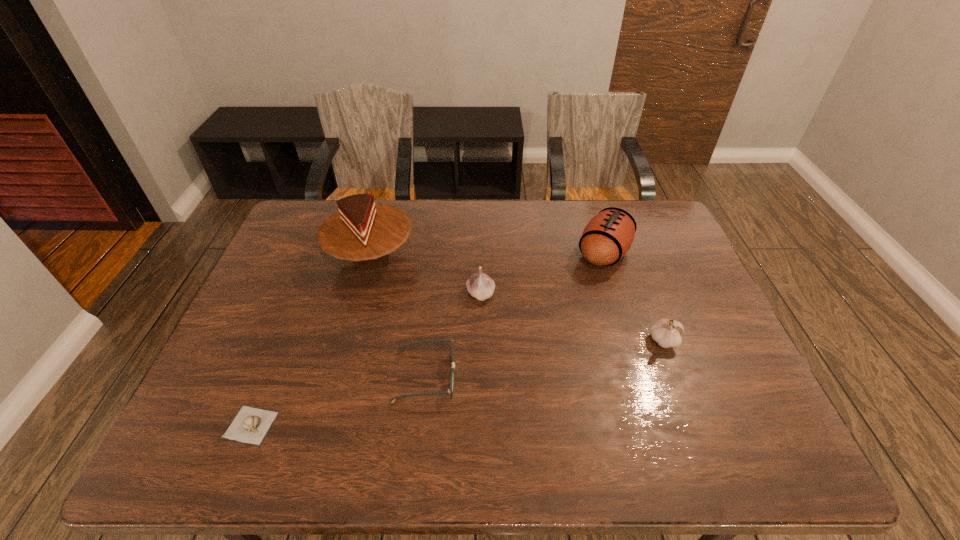
The image size is (960, 540). Identify the location of free space between the second farthest garlic and the second garlic from right to left. (572, 317).

Where is `vacant point located between the spectacles and the football (American)`? Image resolution: width=960 pixels, height=540 pixels. vacant point located between the spectacles and the football (American) is located at coordinates (515, 314).

Where is `empty space between the cake and the fourth object from left to right`? empty space between the cake and the fourth object from left to right is located at coordinates point(426,275).

The image size is (960, 540). In order to click on free spot between the cake and the second tallest object in this screenshot , I will do `click(488, 255)`.

Identify the location of free area in between the tallest object and the second garlic from right to left. The width and height of the screenshot is (960, 540). (426, 275).

The height and width of the screenshot is (540, 960). I want to click on empty location between the second shortest object and the farthest garlic, so click(453, 335).

Image resolution: width=960 pixels, height=540 pixels. I want to click on vacant point located between the third object from right to left and the rightmost garlic, so click(572, 317).

What are the coordinates of `object that is the third closest to the spectacles` in the screenshot? It's located at (250, 425).

Locate an element on the screen. The image size is (960, 540). the closest object to the second nearest garlic is located at coordinates (607, 237).

Point out which garlic is positioned as the nearest to the shortest object. Please provide its 2D coordinates. Your answer should be formatted as a tuple, i.e. [(x, y)], where the tuple contains the x and y coordinates of a point satisfying the conditions above.

[(480, 286)]